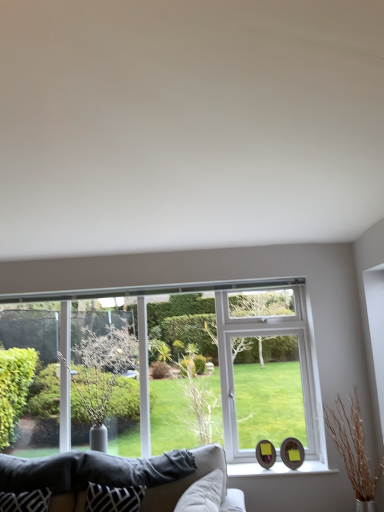
Question: From a real-world perspective, is white glossy window sill at lower center positioned under blue and white fabric pillow at lower center based on gravity?

Choices:
 (A) no
 (B) yes

Answer: (B)

Question: From the image's perspective, does white glossy window sill at lower center appear lower than blue and white fabric pillow at lower center?

Choices:
 (A) no
 (B) yes

Answer: (B)

Question: Is white glossy window sill at lower center outside blue and white fabric pillow at lower center?

Choices:
 (A) yes
 (B) no

Answer: (A)

Question: From a real-world perspective, is white glossy window sill at lower center over blue and white fabric pillow at lower center?

Choices:
 (A) no
 (B) yes

Answer: (A)

Question: Is the depth of white glossy window sill at lower center less than that of blue and white fabric pillow at lower center?

Choices:
 (A) yes
 (B) no

Answer: (B)

Question: Can you confirm if white glossy window sill at lower center is taller than blue and white fabric pillow at lower center?

Choices:
 (A) no
 (B) yes

Answer: (A)

Question: From a real-world perspective, is white glossy window sill at lower center on top of green leafy tree at left?

Choices:
 (A) no
 (B) yes

Answer: (A)

Question: Does white glossy window sill at lower center have a larger size compared to green leafy tree at left?

Choices:
 (A) yes
 (B) no

Answer: (B)

Question: Is the surface of white glossy window sill at lower center in direct contact with green leafy tree at left?

Choices:
 (A) no
 (B) yes

Answer: (A)

Question: Does white glossy window sill at lower center appear on the left side of green leafy tree at left?

Choices:
 (A) no
 (B) yes

Answer: (A)

Question: Considering the relative positions of white glossy window sill at lower center and green leafy tree at left in the image provided, is white glossy window sill at lower center in front of green leafy tree at left?

Choices:
 (A) no
 (B) yes

Answer: (A)

Question: From the image's perspective, would you say white glossy window sill at lower center is shown under green leafy tree at left?

Choices:
 (A) no
 (B) yes

Answer: (B)

Question: Does green leafy tree at left come behind velvet beige couch at lower center?

Choices:
 (A) yes
 (B) no

Answer: (A)